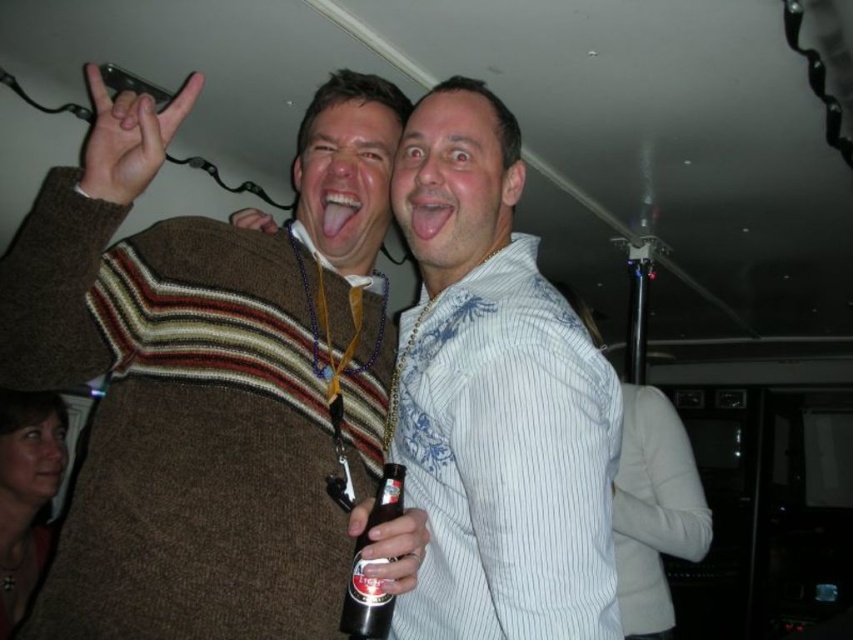
Question: Can you confirm if knitted sweater at center is positioned to the left of matte brown hand at upper left?

Choices:
 (A) yes
 (B) no

Answer: (B)

Question: Observing the image, what is the correct spatial positioning of knitted sweater at center in reference to black glass bottle at center?

Choices:
 (A) below
 (B) above

Answer: (B)

Question: Which point is closer to the camera?

Choices:
 (A) matte black beer bottle at center
 (B) white striped shirt at center

Answer: (B)

Question: Considering the relative positions of matte black beer bottle at center and brown fuzzy sweater at upper center in the image provided, where is matte black beer bottle at center located with respect to brown fuzzy sweater at upper center?

Choices:
 (A) above
 (B) below

Answer: (B)

Question: Which point is farther to the camera?

Choices:
 (A) (350, 593)
 (B) (381, 545)

Answer: (A)

Question: Which point is farther from the camera taking this photo?

Choices:
 (A) (438, 262)
 (B) (372, 605)
 (C) (236, 214)

Answer: (C)